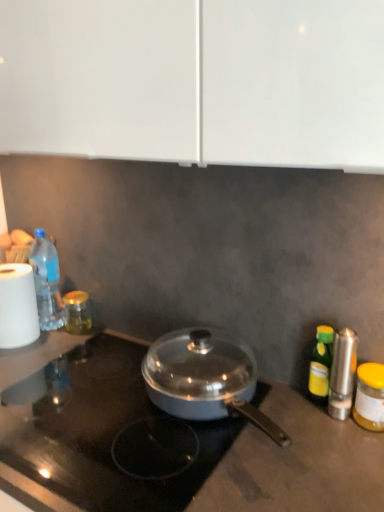
Question: Is translucent plastic bottle at left, the first bottle from the left, in front of or behind gold glass jar at left, the 4th bottle from the front, in the image?

Choices:
 (A) front
 (B) behind

Answer: (A)

Question: Looking at the image, does translucent plastic bottle at left, the first bottle from the left, seem bigger or smaller compared to gold glass jar at left, which ranks as the 1th bottle in back-to-front order?

Choices:
 (A) big
 (B) small

Answer: (A)

Question: Which object is positioned farthest from the green glass bottle at right, the 3th bottle positioned from the back?

Choices:
 (A) gold glass jar at left, which ranks as the 1th bottle in back-to-front order
 (B) translucent plastic bottle at left, positioned as the 4th bottle in right-to-left order
 (C) silver metallic salt shaker at right
 (D) white matte paper towel at left
 (E) yellow matte jar at right, the 1th bottle from the right

Answer: (D)

Question: Estimate the real-world distances between objects in this image. Which object is closer to the gold glass jar at left, which ranks as the 1th bottle in back-to-front order?

Choices:
 (A) translucent plastic bottle at left, positioned as the 4th bottle in right-to-left order
 (B) white matte paper towel at left
 (C) silver metallic salt shaker at right
 (D) metallic gray pan at center
 (E) yellow matte jar at right, the first bottle from the front

Answer: (A)